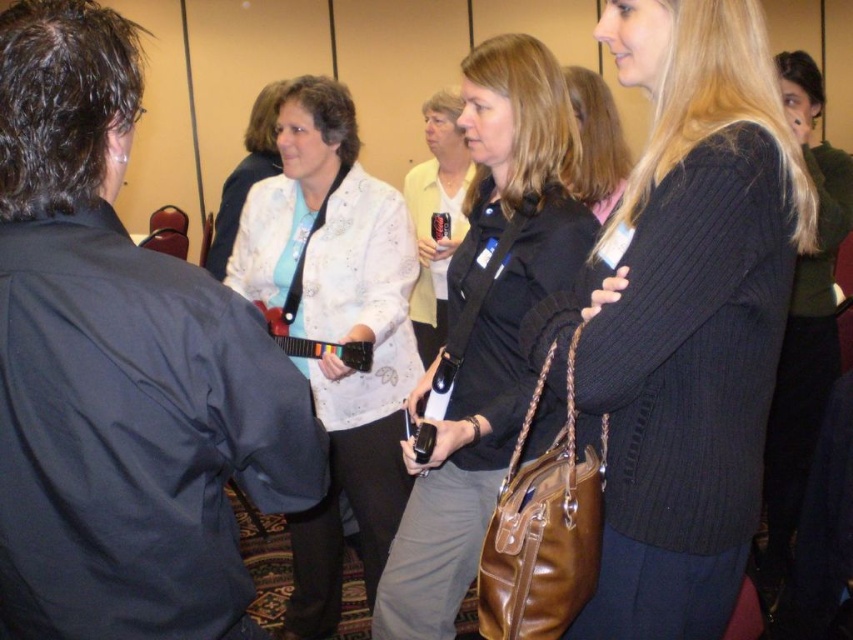
Does point (281, 108) come behind point (590, 113)?

That is False.

Is white textured blouse at center taller than blonde hair at center?

Correct, white textured blouse at center is much taller as blonde hair at center.

Measure the distance between white textured blouse at center and camera.

The distance of white textured blouse at center from camera is 5.95 feet.

Identify the location of white textured blouse at center. (335, 330).

Which is behind, point (744, 220) or point (357, 472)?

Point (357, 472)

In the scene shown: Is the position of black ribbed sweater at center more distant than that of white textured blouse at center?

No, it is not.

Which is in front, point (570, 628) or point (328, 586)?

Positioned in front is point (570, 628).

Locate an element on the screen. black ribbed sweater at center is located at coordinates (689, 316).

Is point (531, 147) closer to viewer compared to point (583, 108)?

Yes, point (531, 147) is closer to viewer.

Which is more to the right, matte black jacket at center or blonde hair at center?

blonde hair at center is more to the right.

Which is in front, point (456, 445) or point (590, 202)?

Positioned in front is point (456, 445).

The height and width of the screenshot is (640, 853). I want to click on matte black jacket at center, so click(486, 324).